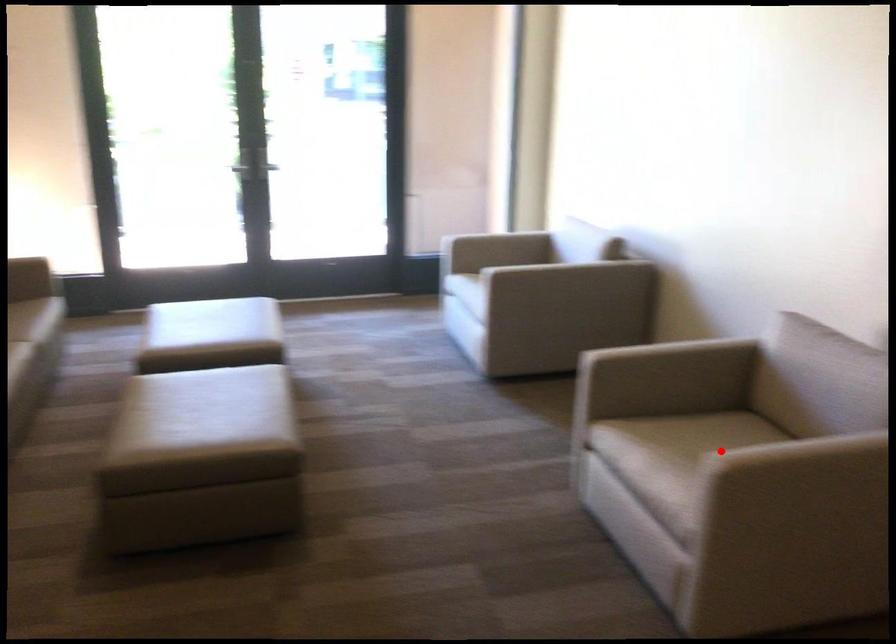
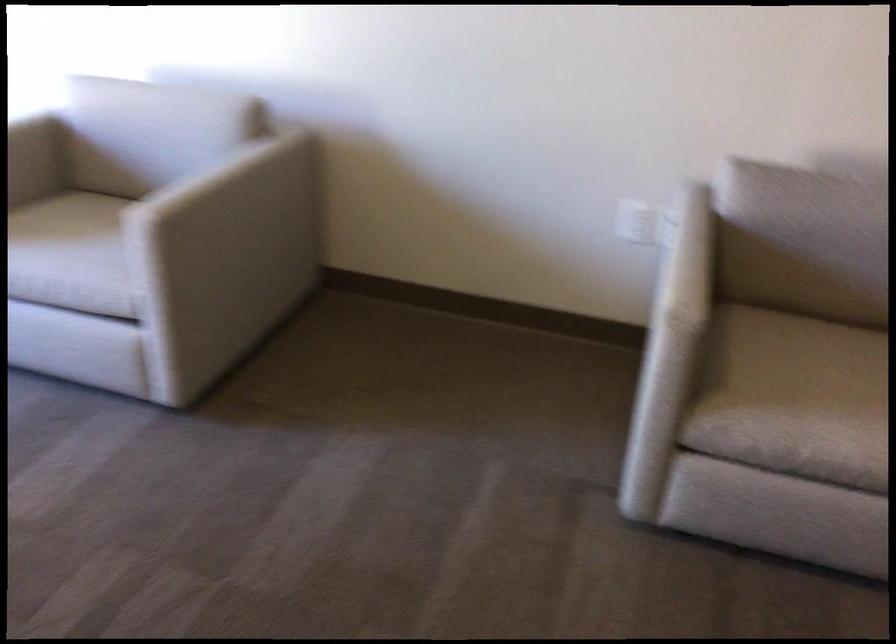
Where in the second image is the point corresponding to the highlighted location from the first image?

(819, 361)